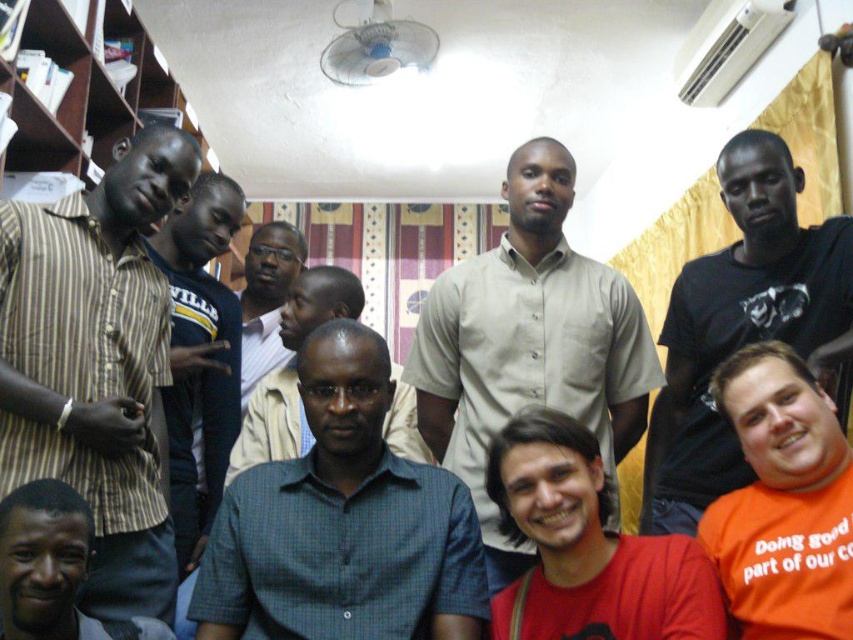
Question: Which point is closer to the camera taking this photo?

Choices:
 (A) (299, 230)
 (B) (22, 538)
 (C) (550, 358)
 (D) (674, 554)

Answer: (B)

Question: Which object appears closest to the camera in this image?

Choices:
 (A) dark blue jersey at left
 (B) dark green shirt at center

Answer: (A)

Question: Which point appears closest to the camera in this image?

Choices:
 (A) (285, 356)
 (B) (35, 529)
 (C) (224, 342)
 (D) (685, 362)

Answer: (B)

Question: Can you confirm if black matte shirt at upper right is positioned to the left of dark green shirt at center?

Choices:
 (A) no
 (B) yes

Answer: (A)

Question: Is red matte shirt at lower right below dark blue jersey at left?

Choices:
 (A) no
 (B) yes

Answer: (B)

Question: Can you confirm if green checkered shirt at center is positioned to the right of light beige shirt at center?

Choices:
 (A) yes
 (B) no

Answer: (B)